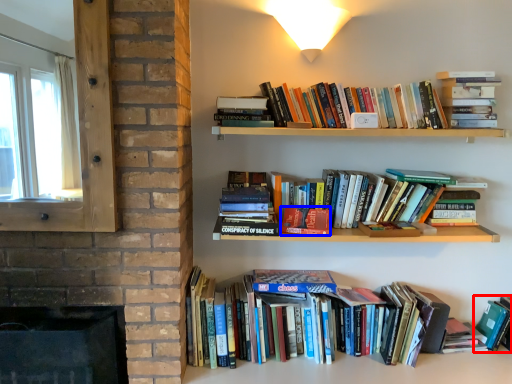
Question: Which of the following is the farthest to the observer, book (highlighted by a red box) or paperback book (highlighted by a blue box)?

Choices:
 (A) book
 (B) paperback book

Answer: (A)